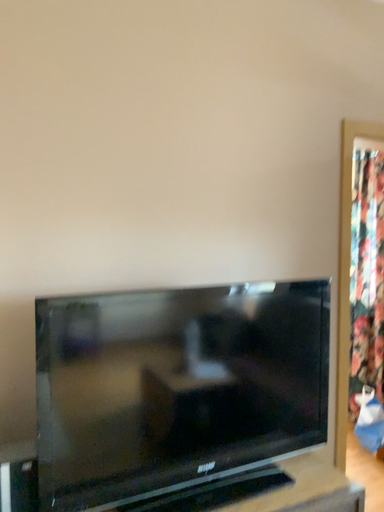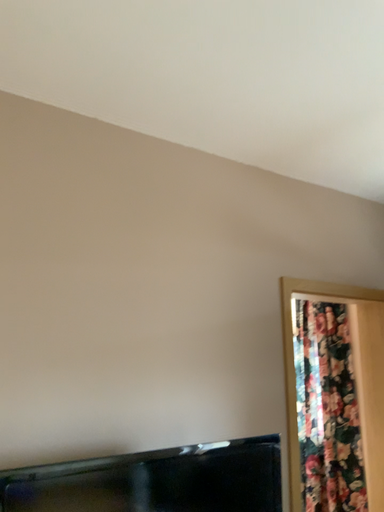
Question: How did the camera likely rotate when shooting the video?

Choices:
 (A) rotated upward
 (B) rotated downward

Answer: (A)